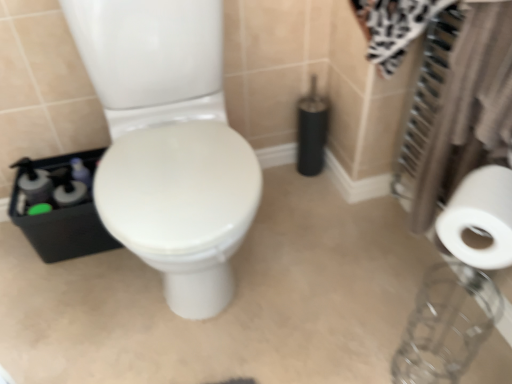
Where is `vacant area located to the right-hand side of white glossy toilet at center`? The height and width of the screenshot is (384, 512). vacant area located to the right-hand side of white glossy toilet at center is located at coordinates (336, 265).